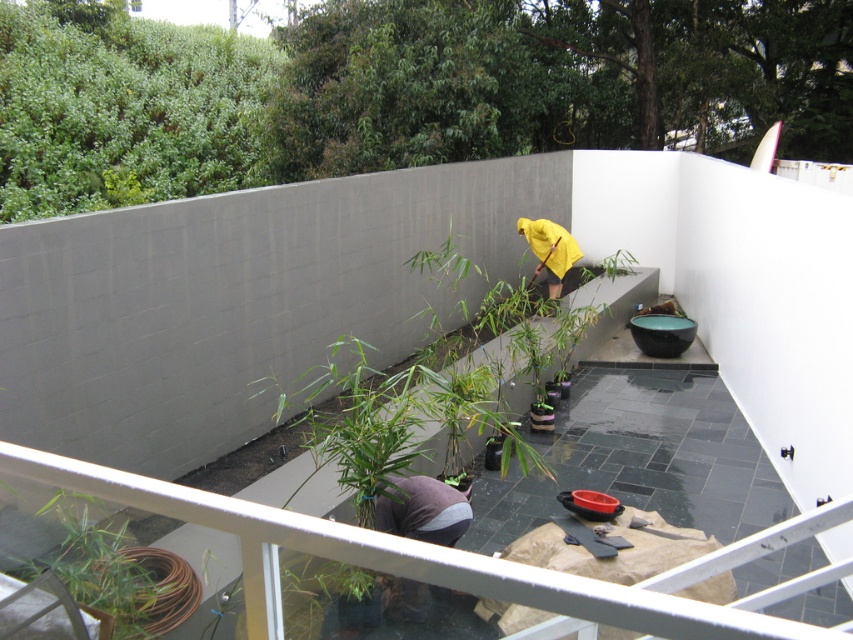
You are a gardener who wants to place a new small statue between the green leafy plant at upper center and the green bamboo at lower left. Based on their widths, which side should you place the statue to ensure it fits without overcrowding?

The green leafy plant at upper center might be wider than green bamboo at lower left, so placing the statue closer to the green bamboo at lower left would provide more space and prevent overcrowding.

You are a guest at this balcony and want to place a small potted plant. The gray fabric at lower center and the yellow fabric at center are both fabric covers for plant pots. Which fabric cover is more suitable for a smaller potted plant?

The gray fabric at lower center is smaller than the yellow fabric at center, so it is more suitable for a smaller potted plant.

You are a delivery drone with a wingspan of 6 meters. You need to fly through the gap between the green bamboo at lower left and the yellow fabric at center. Can you fit through this space?

The distance between the green bamboo at lower left and the yellow fabric at center is 6.94 meters. Since your wingspan is 6 meters, you can safely pass through the gap as it is wider than your drone.